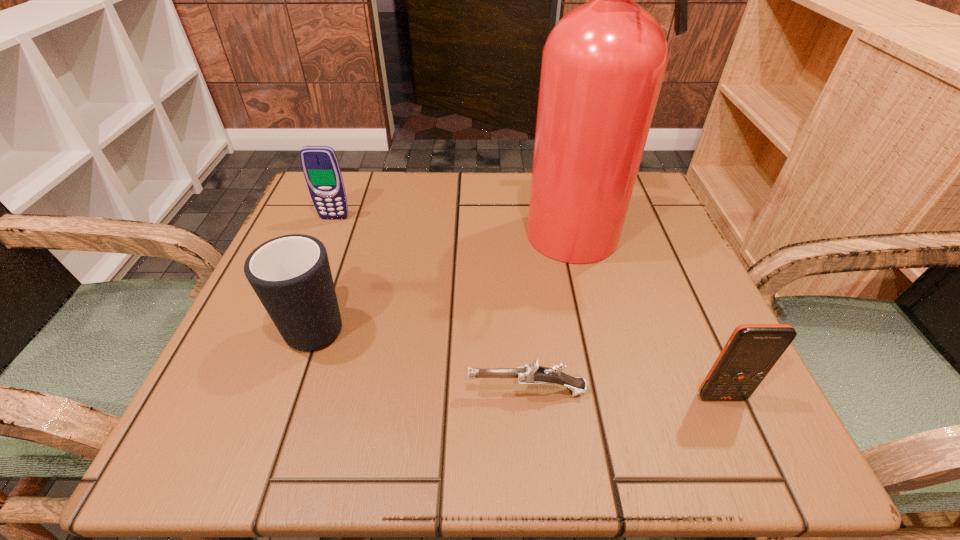
Identify the location of fire extinguisher at the right edge. This screenshot has width=960, height=540. (603, 64).

The image size is (960, 540). What are the coordinates of `cellular telephone at the right edge` in the screenshot? It's located at (752, 350).

At what (x,y) coordinates should I click in order to perform the action: click on object that is positioned at the far left corner. Please return your answer as a coordinate pair (x, y). Looking at the image, I should click on (320, 165).

Identify the location of object that is at the far right corner. Image resolution: width=960 pixels, height=540 pixels. (603, 64).

Locate an element on the screen. This screenshot has width=960, height=540. object at the near right corner is located at coordinates (752, 350).

Locate an element on the screen. The width and height of the screenshot is (960, 540). vacant area at the far edge of the desktop is located at coordinates (442, 228).

Locate an element on the screen. free space at the near edge of the desktop is located at coordinates (498, 454).

At what (x,y) coordinates should I click in order to perform the action: click on vacant space at the left edge of the desktop. Please return your answer as a coordinate pair (x, y). Looking at the image, I should click on (218, 392).

This screenshot has width=960, height=540. What are the coordinates of `vacant region at the right edge of the desktop` in the screenshot? It's located at (614, 264).

You are a GUI agent. You are given a task and a screenshot of the screen. Output one action in this format:
    pyautogui.click(x=<x>, y=<y>)
    Task: Click on the free space at the far left corner of the desktop
    The image size is (960, 540).
    Given the screenshot: What is the action you would take?
    pyautogui.click(x=382, y=186)